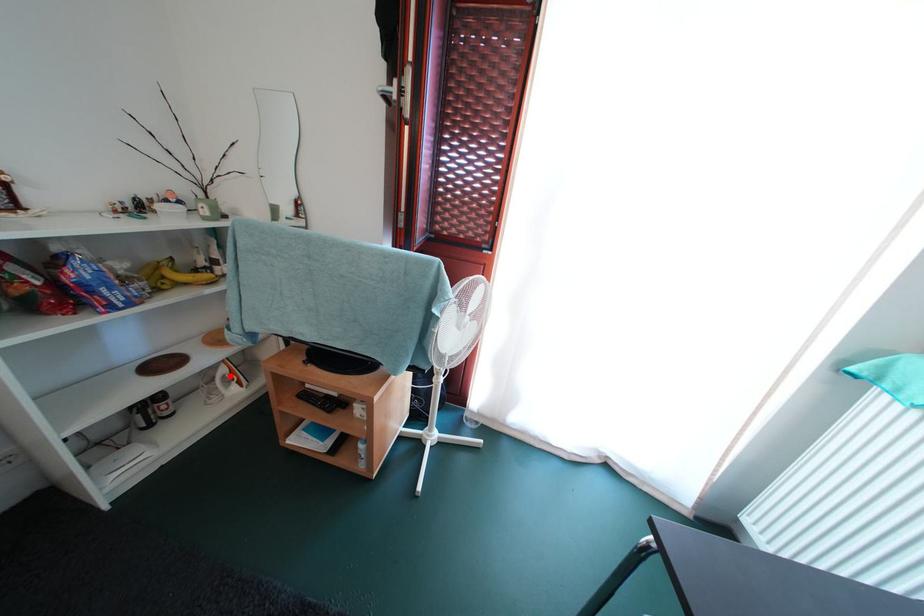
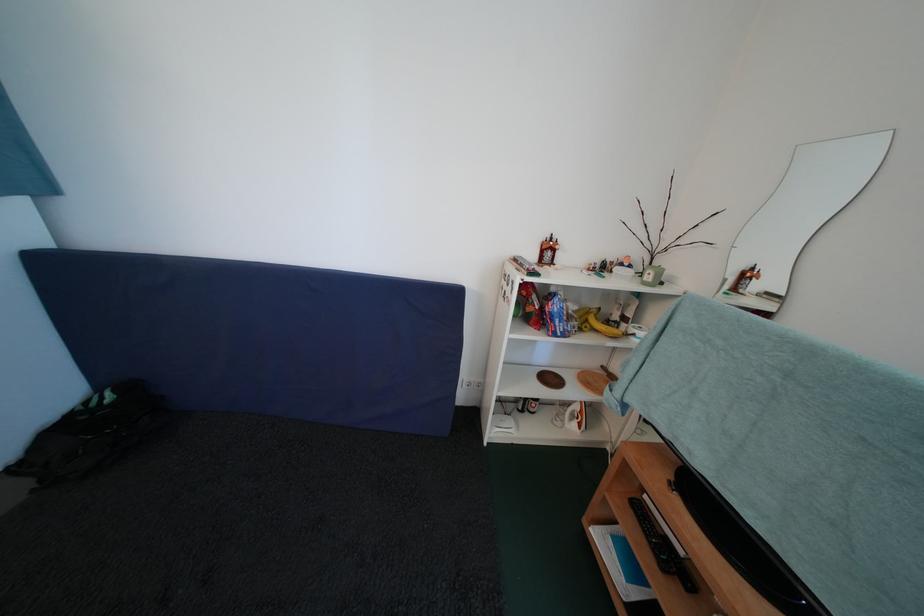
In the second image, find the point that corresponds to the highlighted location in the first image.

(584, 411)